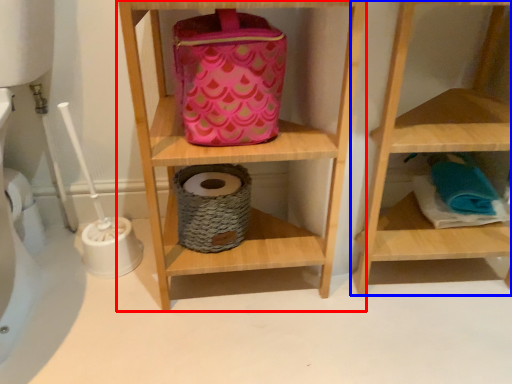
Question: Which object is closer to the camera taking this photo, shelf (highlighted by a red box) or shelf (highlighted by a blue box)?

Choices:
 (A) shelf
 (B) shelf

Answer: (A)